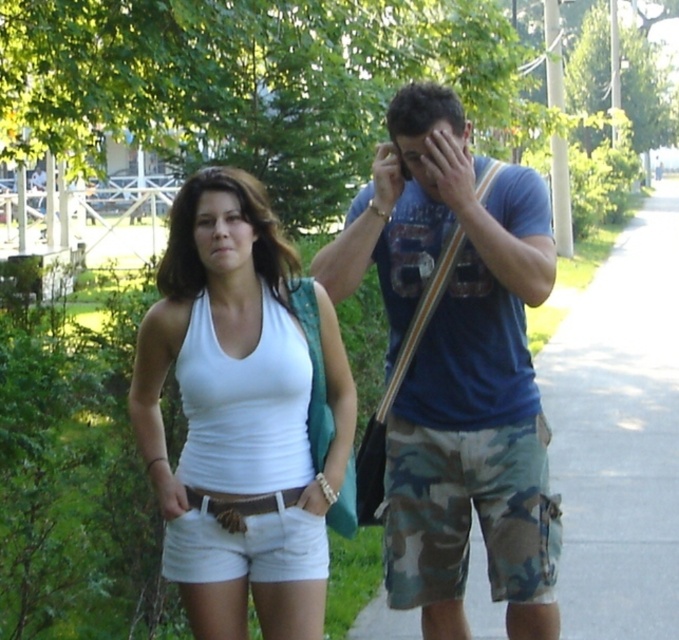
You are a photographer trying to focus on the matte white tank top at center and the camo shorts at right. Which one should you adjust your camera to focus on first if you want to capture both clearly?

The matte white tank top at center should be focused on first because it is behind the camo shorts at right, so adjusting focus starting from the background and moving forward would ensure both are in focus.

You are trying to decide which item is taller between the camo shorts at right and the matte white tank top at center. Based on the scene description, which one is taller?

The camo shorts at right is much taller than the matte white tank top at center according to the description.